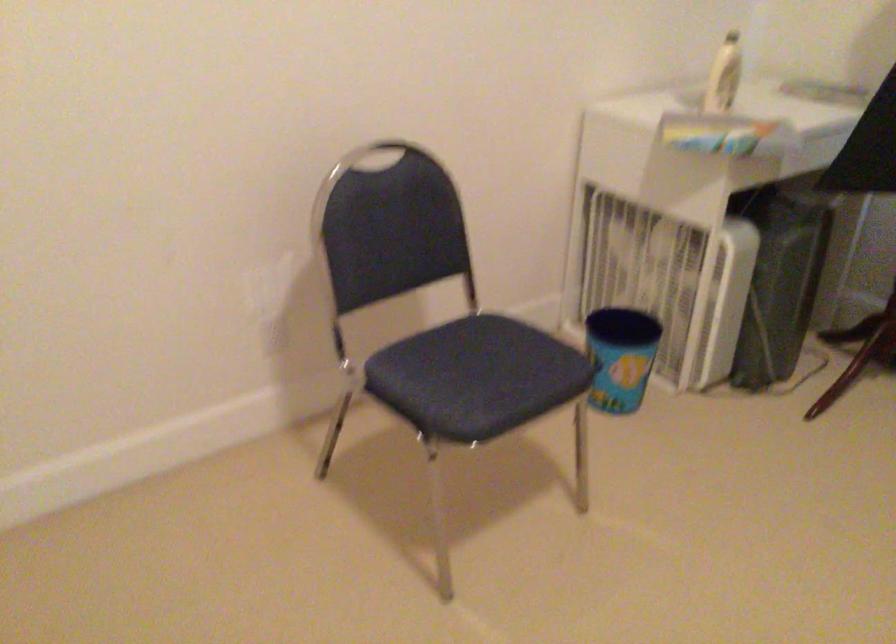
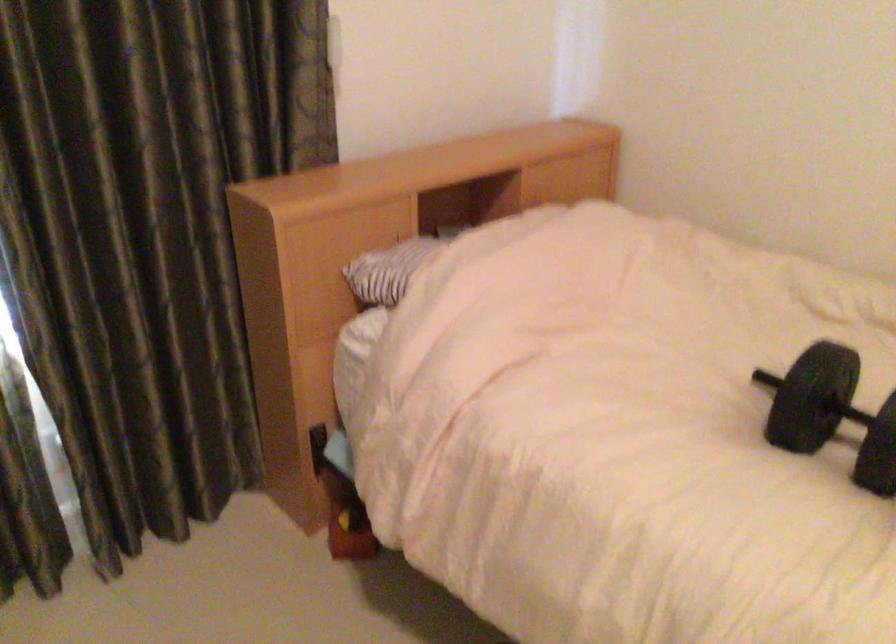
How did the camera likely rotate?

The rotation direction of the camera is right-down.